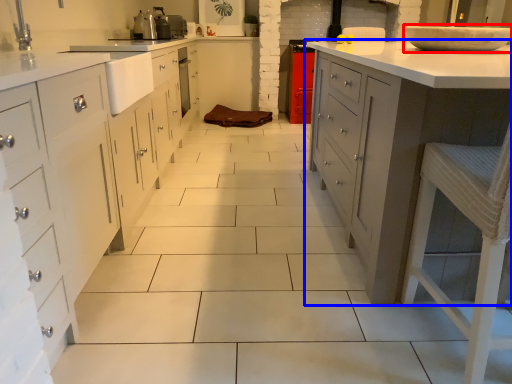
Question: Which object appears closest to the camera in this image, home appliance (highlighted by a red box) or countertop (highlighted by a blue box)?

Choices:
 (A) home appliance
 (B) countertop

Answer: (B)